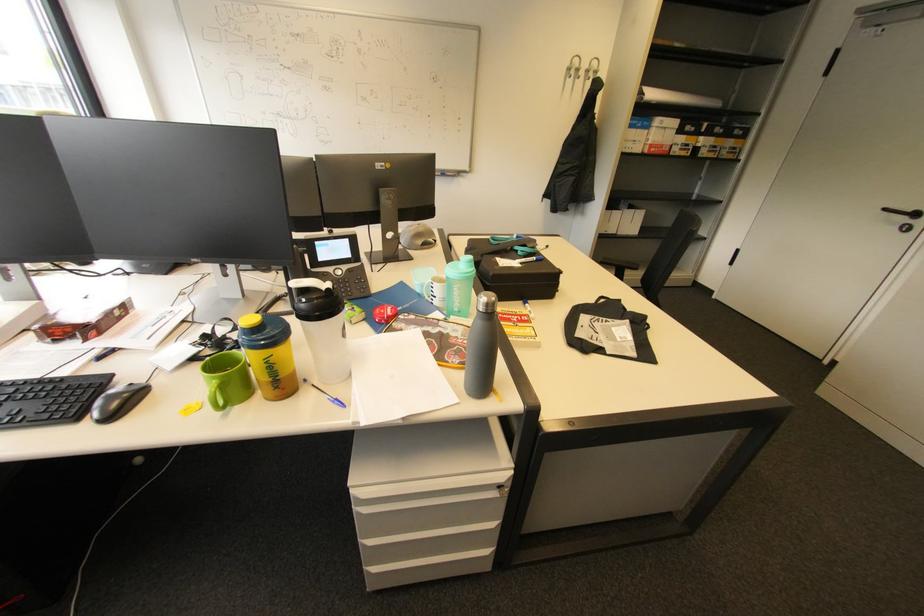
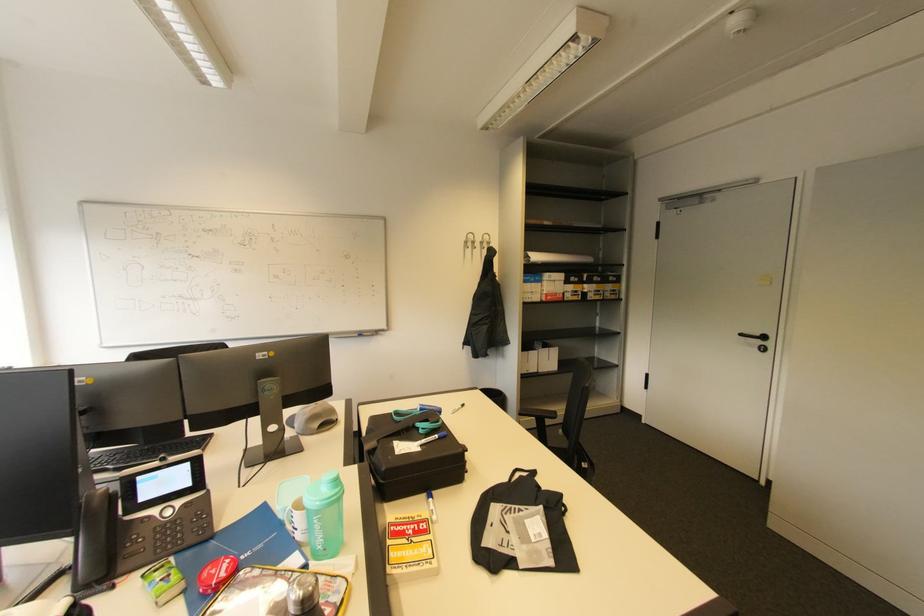
Locate, in the second image, the point that corresponds to the point at 440,298 in the first image.

(300, 531)